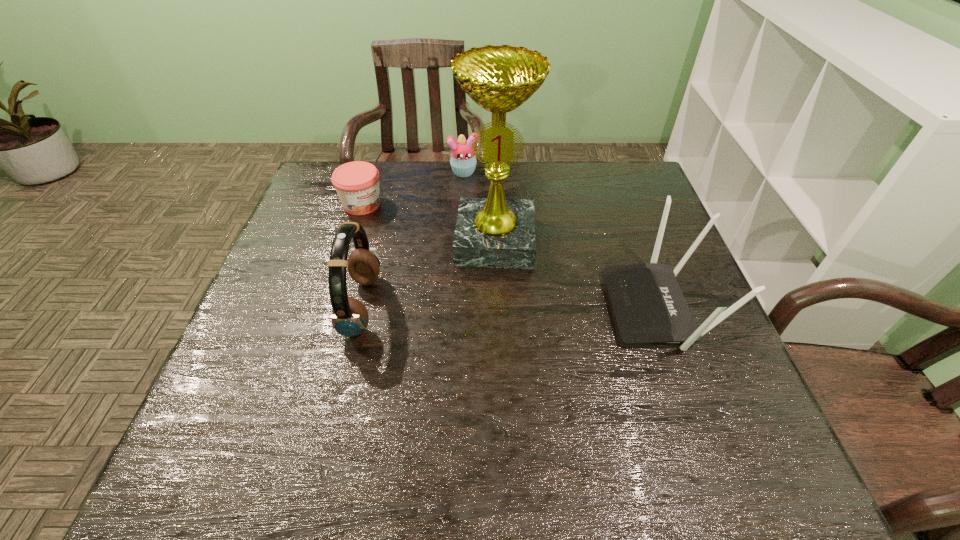
Identify the location of vacant space on the desktop that is between the headset and the rightmost object and is positioned on the front-facing side of the award. (492, 307).

Locate an element on the screen. vacant space on the desktop that is between the headset and the rightmost object and is positioned on the front label of the jam is located at coordinates (483, 307).

Where is `vacant spot on the desktop that is between the headset and the rightmost object and is positioned on the face of the cupcake`? The height and width of the screenshot is (540, 960). vacant spot on the desktop that is between the headset and the rightmost object and is positioned on the face of the cupcake is located at coordinates (490, 307).